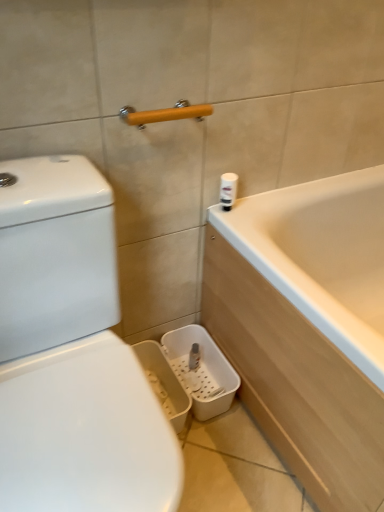
Question: In terms of width, does white plastic canister at upper right look wider or thinner when compared to yellow matte towel bar at upper center?

Choices:
 (A) wide
 (B) thin

Answer: (B)

Question: From the image's perspective, is white plastic canister at upper right positioned above or below yellow matte towel bar at upper center?

Choices:
 (A) below
 (B) above

Answer: (A)

Question: From a real-world perspective, is white plastic canister at upper right above or below yellow matte towel bar at upper center?

Choices:
 (A) above
 (B) below

Answer: (B)

Question: In terms of width, does yellow matte towel bar at upper center look wider or thinner when compared to white plastic canister at upper right?

Choices:
 (A) thin
 (B) wide

Answer: (B)

Question: From a real-world perspective, is yellow matte towel bar at upper center above or below white plastic canister at upper right?

Choices:
 (A) below
 (B) above

Answer: (B)

Question: Relative to white plastic canister at upper right, is yellow matte towel bar at upper center in front or behind?

Choices:
 (A) front
 (B) behind

Answer: (A)

Question: From the image's perspective, is yellow matte towel bar at upper center located above or below white plastic canister at upper right?

Choices:
 (A) above
 (B) below

Answer: (A)